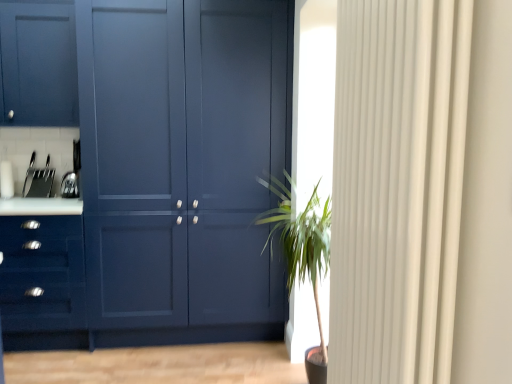
Question: Is white textured curtain at right to the left or to the right of green leafy plant at center in the image?

Choices:
 (A) right
 (B) left

Answer: (A)

Question: From a real-world perspective, is white textured curtain at right positioned above or below green leafy plant at center?

Choices:
 (A) below
 (B) above

Answer: (B)

Question: Which object is the closest to the matte blue drawer at left?

Choices:
 (A) matte blue cabinet at center
 (B) satin silver toaster at left
 (C) white textured curtain at right
 (D) green leafy plant at center

Answer: (A)

Question: Considering the real-world distances, which object is farthest from the matte blue cabinet at center?

Choices:
 (A) white textured curtain at right
 (B) matte blue drawer at left
 (C) satin silver toaster at left
 (D) green leafy plant at center

Answer: (A)